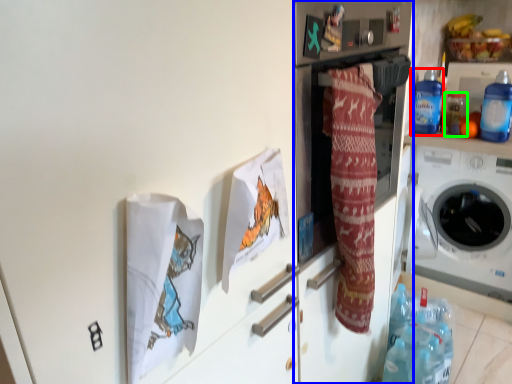
Question: Considering the real-world distances, which object is closest to bottle (highlighted by a red box)? fridge (highlighted by a blue box) or bottle (highlighted by a green box).

Choices:
 (A) fridge
 (B) bottle

Answer: (B)